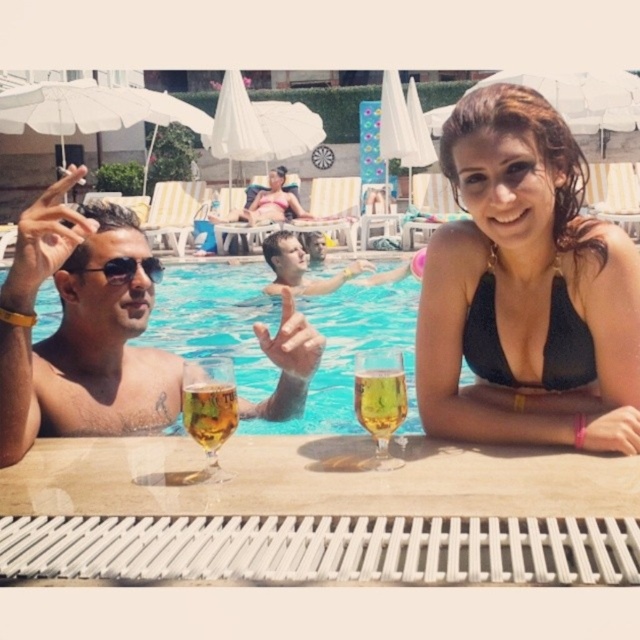
Based on the photo, which is above, black matte bikini top at upper right or smooth skin man at center?

Positioned higher is smooth skin man at center.

Is point (518, 381) closer to camera compared to point (301, 250)?

Yes, it is in front of point (301, 250).

Where is `black matte bikini top at upper right`? The height and width of the screenshot is (640, 640). black matte bikini top at upper right is located at coordinates (544, 344).

In the scene shown: Which of these two, black matte bikini at upper right or sunglasses at upper left, stands shorter?

sunglasses at upper left

Which is behind, point (520, 90) or point (157, 259)?

The point (157, 259) is behind.

Does point (465, 161) come farther from viewer compared to point (148, 276)?

That is False.

The width and height of the screenshot is (640, 640). Identify the location of black matte bikini at upper right. (525, 289).

Does black matte bikini at upper right have a lesser width compared to transparent glass water at center?

Yes, black matte bikini at upper right is thinner than transparent glass water at center.

Who is more forward, (563, 314) or (406, 422)?

Point (563, 314) is more forward.

Where is `black matte bikini at upper right`? The height and width of the screenshot is (640, 640). black matte bikini at upper right is located at coordinates (525, 289).